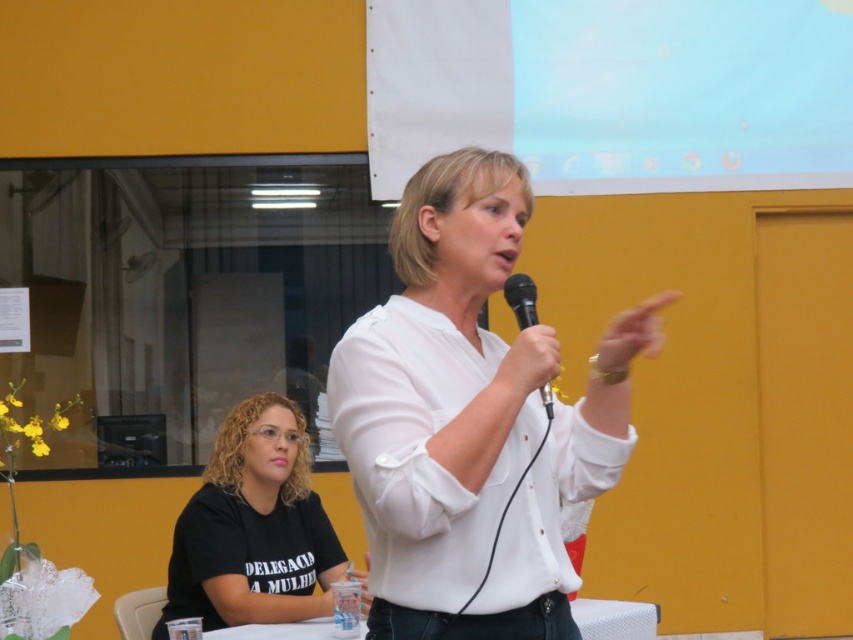
You are a photographer adjusting the focus on your camera. You need to focus on two specific points in the image. The first point is at coordinate point(x=619, y=605) and the second is at point(x=531, y=300). Which point should you focus on first if you want to capture the foreground subject clearly?

Point(x=531, y=300) should be focused on first because it is closer to the camera than point(x=619, y=605), ensuring the foreground subject is in clear focus.

You are a photographer standing in front of the scene. You want to take a photo of the black matte microphone at center while ensuring the white plastic table at lower center is also visible in the frame. Can you position yourself so that both objects are in the shot without moving any of them?

The white plastic table at lower center is further to the viewer than the black matte microphone at center, so positioning yourself at an angle where both objects are in the same line of sight would allow both to be captured in the photo.

You are organizing a small event and need to place a 75 cm wide banner between the black matte shirt at lower left and the white plastic table at lower center. Is there enough space for the banner?

The distance between the black matte shirt at lower left and the white plastic table at lower center is 73.91 centimeters. Since the banner is 75 cm wide, it is slightly too wide to fit in the available space.